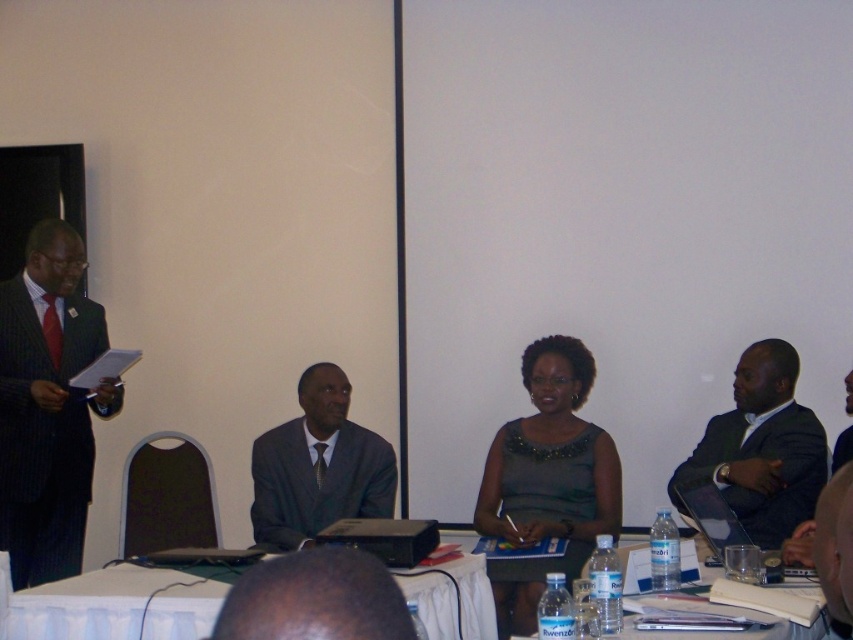
Question: Where is matte black suit at left located in relation to green satin dress at center in the image?

Choices:
 (A) right
 (B) left

Answer: (B)

Question: Does white cloth-covered table at lower center have a larger size compared to dark gray suit at right?

Choices:
 (A) yes
 (B) no

Answer: (B)

Question: Which object appears closest to the camera in this image?

Choices:
 (A) matte black suit at left
 (B) white cloth-covered table at lower center

Answer: (B)

Question: Which object appears farthest from the camera in this image?

Choices:
 (A) matte black suit at left
 (B) green satin dress at center
 (C) white cloth-covered table at lower center

Answer: (A)

Question: Which point is farther to the camera?

Choices:
 (A) white cloth-covered table at lower center
 (B) dark gray suit at center

Answer: (B)

Question: Is white cloth-covered table at lower center to the right of dark gray suit at right from the viewer's perspective?

Choices:
 (A) yes
 (B) no

Answer: (B)